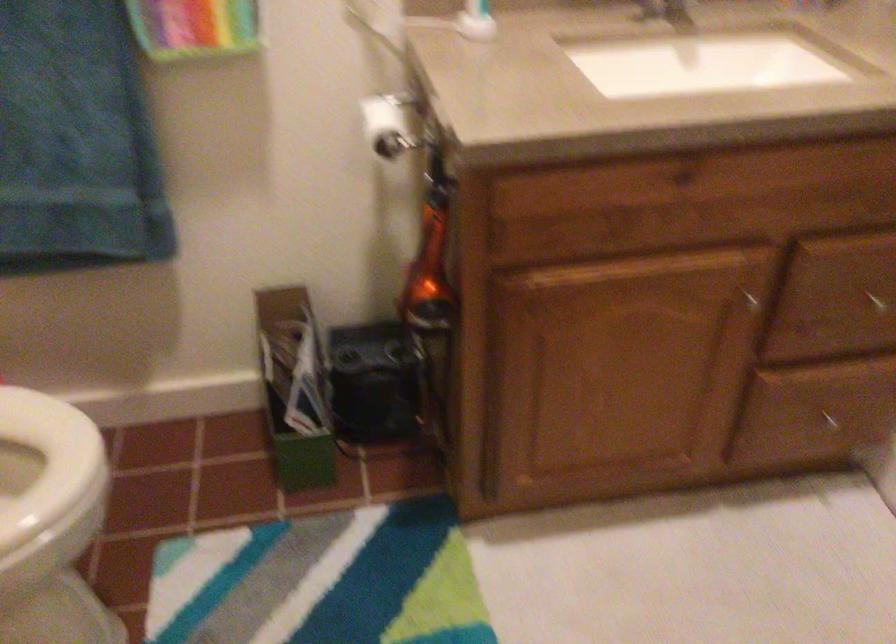
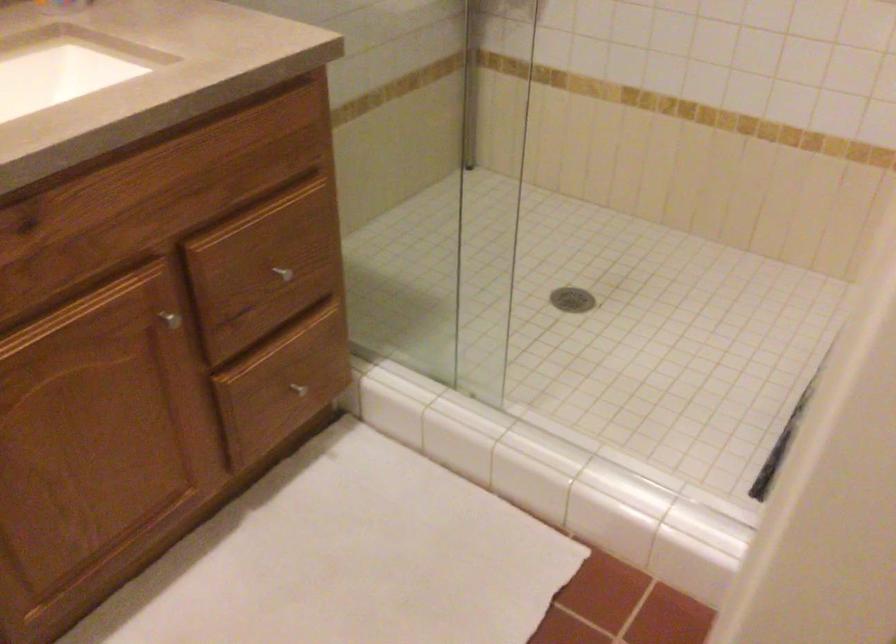
In the second image, find the point that corresponds to the point at 746,299 in the first image.

(169, 319)